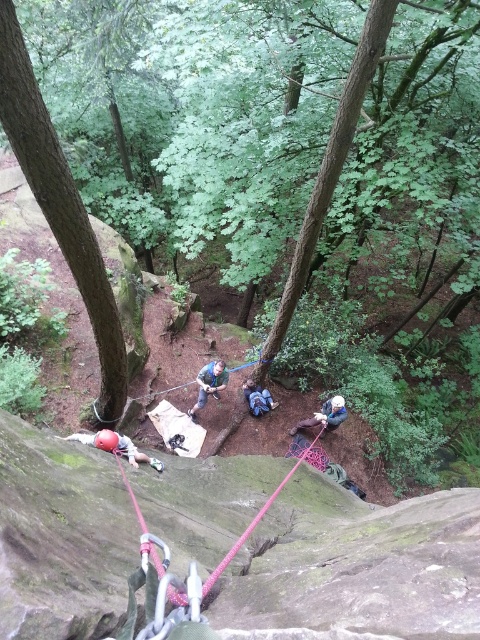
Question: Among these points, which one is farthest from the camera?

Choices:
 (A) (307, 420)
 (B) (218, 372)
 (C) (83, 442)

Answer: (A)

Question: Among these objects, which one is farthest from the camera?

Choices:
 (A) matte red helmet at lower left
 (B) blue fabric bag at center
 (C) blue fabric at center

Answer: (C)

Question: Estimate the real-world distances between objects in this image. Which object is closer to the matte red helmet at lower left?

Choices:
 (A) brown rough tree trunk at left
 (B) blue fabric bag at center

Answer: (A)

Question: Is blue fabric bag at center positioned behind blue fabric at center?

Choices:
 (A) no
 (B) yes

Answer: (A)

Question: Can you confirm if brown rough tree trunk at left is positioned above blue fabric bag at center?

Choices:
 (A) no
 (B) yes

Answer: (B)

Question: Does green rough bark tree at center have a larger size compared to matte red helmet at lower left?

Choices:
 (A) no
 (B) yes

Answer: (B)